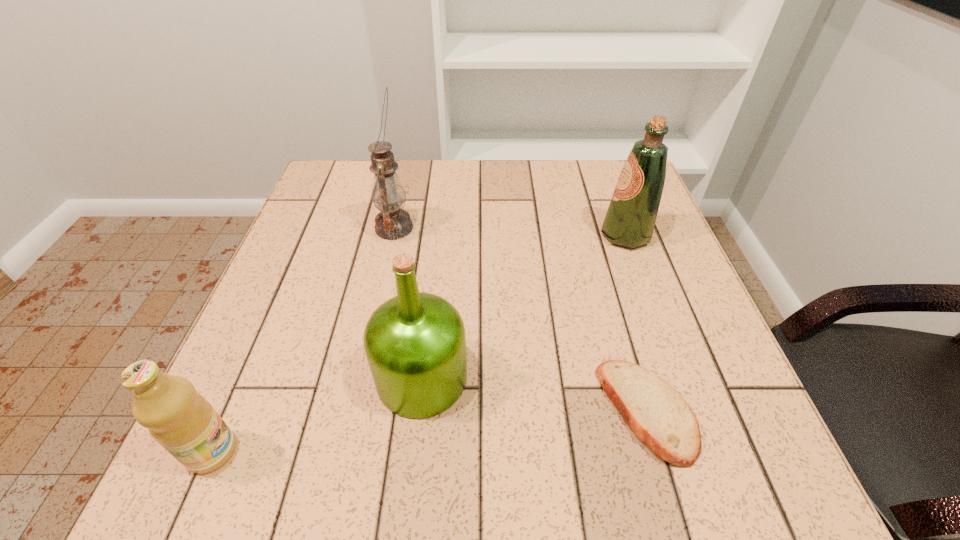
Where is `unoccupied position between the oil lamp and the farthest olive oil`? Image resolution: width=960 pixels, height=540 pixels. unoccupied position between the oil lamp and the farthest olive oil is located at coordinates (510, 232).

The height and width of the screenshot is (540, 960). What are the coordinates of `free point between the second farthest olive oil and the rightmost olive oil` in the screenshot? It's located at (523, 306).

Where is `vacant point located between the pita bread and the oil lamp`? The image size is (960, 540). vacant point located between the pita bread and the oil lamp is located at coordinates (520, 320).

Identify the location of object that ranks as the closest to the shortest object. The height and width of the screenshot is (540, 960). (415, 343).

At what (x,y) coordinates should I click in order to perform the action: click on object that stands as the fourth closest to the farthest olive oil. Please return your answer as a coordinate pair (x, y). The height and width of the screenshot is (540, 960). Looking at the image, I should click on [x=181, y=420].

Identify the location of the second closest olive oil to the second farthest olive oil. The image size is (960, 540). (630, 219).

Locate which olive oil is the second closest to the pita bread. Please provide its 2D coordinates. Your answer should be formatted as a tuple, i.e. [(x, y)], where the tuple contains the x and y coordinates of a point satisfying the conditions above.

[(630, 219)]

Identify the location of vacant area in the image that satisfies the following two spatial constraints: 1. on the front side of the second olive oil from right to left; 2. on the label of the nearest olive oil. (414, 451).

I want to click on free point that satisfies the following two spatial constraints: 1. on the front side of the shortest object; 2. on the left side of the oil lamp, so click(354, 411).

The width and height of the screenshot is (960, 540). What are the coordinates of `vacant area that satisfies the following two spatial constraints: 1. on the front side of the pita bread; 2. on the right side of the oil lamp` in the screenshot? It's located at (354, 411).